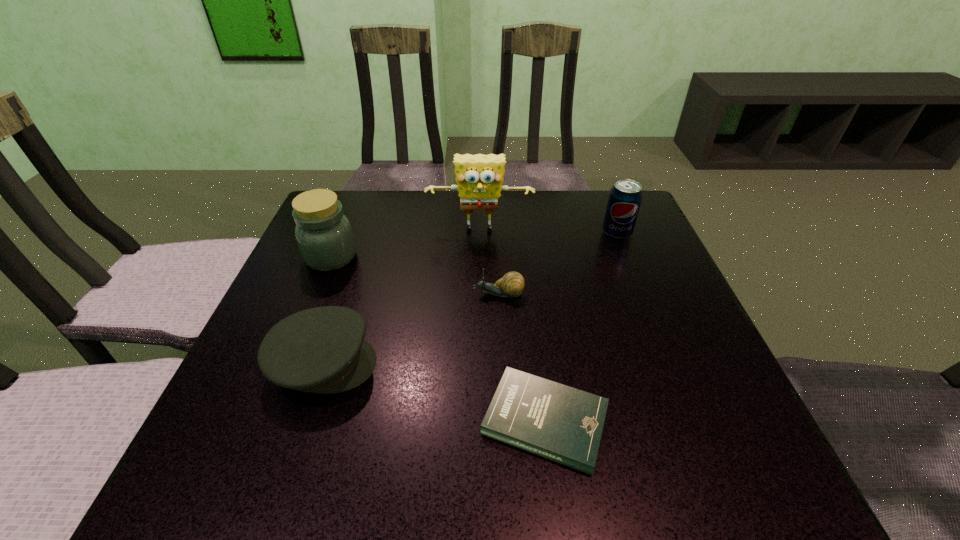
At what (x,y) coordinates should I click in order to perform the action: click on beret positioned at the left edge. Please return your answer as a coordinate pair (x, y). Image resolution: width=960 pixels, height=540 pixels. Looking at the image, I should click on click(x=322, y=350).

Image resolution: width=960 pixels, height=540 pixels. I want to click on object that is at the right edge, so click(x=625, y=197).

Image resolution: width=960 pixels, height=540 pixels. Identify the location of object present at the far right corner. (625, 197).

Find the location of a particular element. The width and height of the screenshot is (960, 540). free space at the far edge is located at coordinates (x=480, y=238).

Image resolution: width=960 pixels, height=540 pixels. What are the coordinates of `vacant region at the left edge of the desktop` in the screenshot? It's located at (276, 308).

Locate an element on the screen. This screenshot has height=540, width=960. free space at the right edge is located at coordinates (647, 266).

In the image, there is a desktop. Identify the location of vacant space at the far left corner. (357, 216).

Identify the location of free space at the far right corner of the desktop. This screenshot has width=960, height=540. (602, 201).

At what (x,y) coordinates should I click in order to perform the action: click on free region at the near right corner. Please return your answer as a coordinate pair (x, y). This screenshot has width=960, height=540. Looking at the image, I should click on (768, 489).

Where is `vacant space that's between the shortest object and the jar`? The height and width of the screenshot is (540, 960). vacant space that's between the shortest object and the jar is located at coordinates (438, 339).